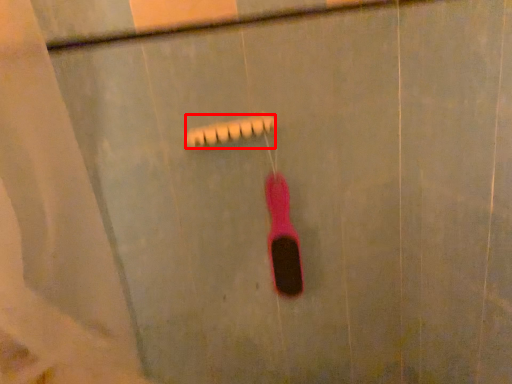
Question: From the image's perspective, considering the relative positions of shower (annotated by the red box) and toothbrush in the image provided, where is shower (annotated by the red box) located with respect to the staircase?

Choices:
 (A) below
 (B) above

Answer: (B)